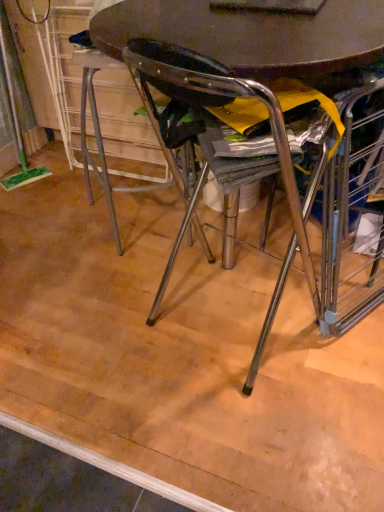
Question: Is matte wood floor at center thinner than metallic brown table at center?

Choices:
 (A) no
 (B) yes

Answer: (A)

Question: Considering the relative sizes of matte wood floor at center and metallic brown table at center in the image provided, is matte wood floor at center shorter than metallic brown table at center?

Choices:
 (A) yes
 (B) no

Answer: (A)

Question: Is matte wood floor at center smaller than metallic brown table at center?

Choices:
 (A) yes
 (B) no

Answer: (A)

Question: Is matte wood floor at center aimed at metallic brown table at center?

Choices:
 (A) no
 (B) yes

Answer: (A)

Question: Is matte wood floor at center with metallic brown table at center?

Choices:
 (A) no
 (B) yes

Answer: (A)

Question: Would you say matte wood floor at center contains metallic brown table at center?

Choices:
 (A) no
 (B) yes

Answer: (A)

Question: From the image's perspective, is metallic brown table at center under matte wood floor at center?

Choices:
 (A) yes
 (B) no

Answer: (B)

Question: Is metallic brown table at center to the right of matte wood floor at center from the viewer's perspective?

Choices:
 (A) yes
 (B) no

Answer: (A)

Question: Is metallic brown table at center looking in the opposite direction of matte wood floor at center?

Choices:
 (A) yes
 (B) no

Answer: (B)

Question: Is metallic brown table at center completely or partially outside of matte wood floor at center?

Choices:
 (A) yes
 (B) no

Answer: (A)

Question: Can you confirm if metallic brown table at center is thinner than matte wood floor at center?

Choices:
 (A) no
 (B) yes

Answer: (B)

Question: Considering the relative sizes of metallic brown table at center and matte wood floor at center in the image provided, is metallic brown table at center shorter than matte wood floor at center?

Choices:
 (A) no
 (B) yes

Answer: (A)

Question: Based on their sizes in the image, would you say matte wood floor at center is bigger or smaller than metallic brown table at center?

Choices:
 (A) big
 (B) small

Answer: (B)